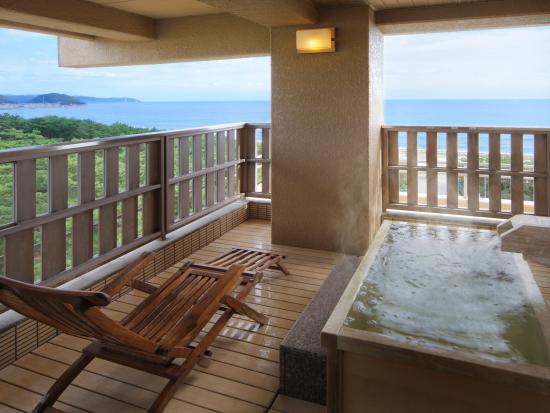
Identify the location of chair. (177, 316).